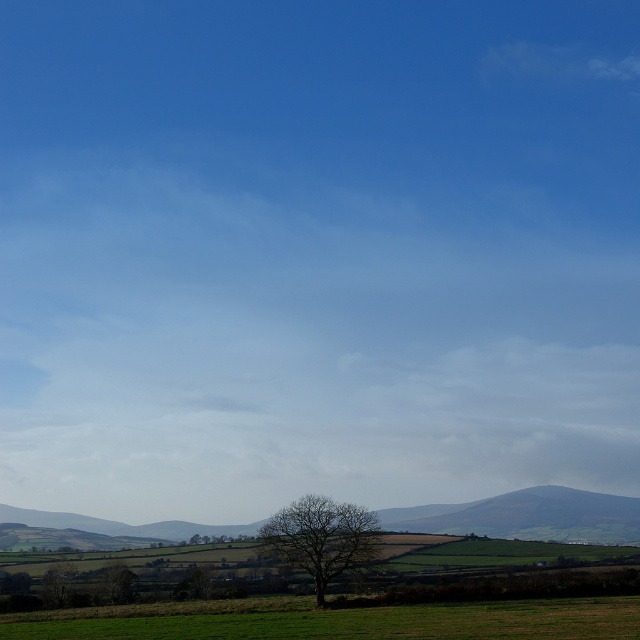
Question: Which point is closer to the camera taking this photo?

Choices:
 (A) (116, 582)
 (B) (592, 634)

Answer: (B)

Question: Is green grassy field at lower center to the right of bare tree at center from the viewer's perspective?

Choices:
 (A) yes
 (B) no

Answer: (A)

Question: Does green grassy hillside at lower center lie in front of green leafy tree at lower center?

Choices:
 (A) yes
 (B) no

Answer: (B)

Question: Which point is closer to the camera?

Choices:
 (A) (291, 518)
 (B) (433, 637)
 (C) (545, 506)
 (D) (129, 593)

Answer: (B)

Question: Which of the following is the farthest from the observer?

Choices:
 (A) (122, 573)
 (B) (324, 637)
 (C) (326, 522)

Answer: (A)

Question: Observing the image, what is the correct spatial positioning of green grassy field at lower center in reference to green grassy hillside at lower center?

Choices:
 (A) right
 (B) left

Answer: (A)